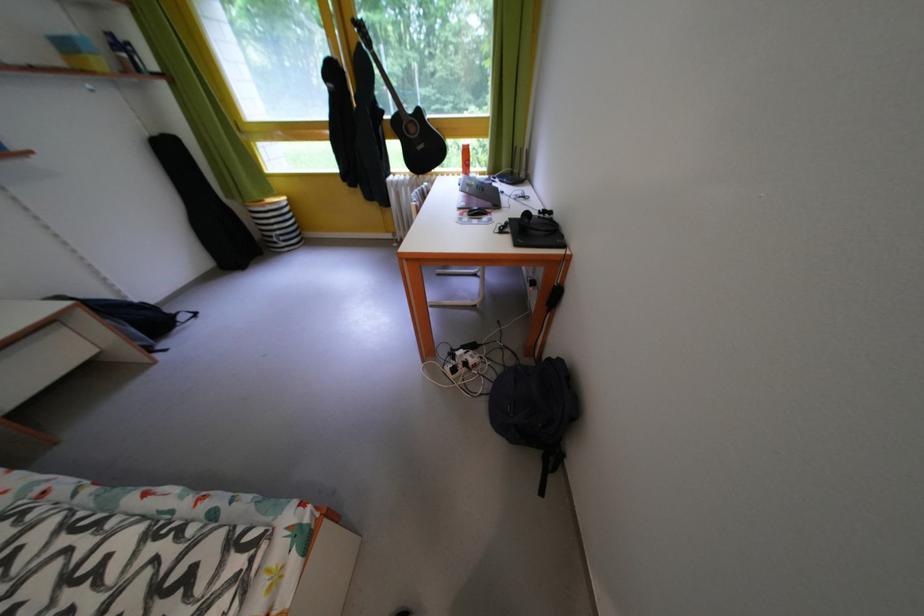
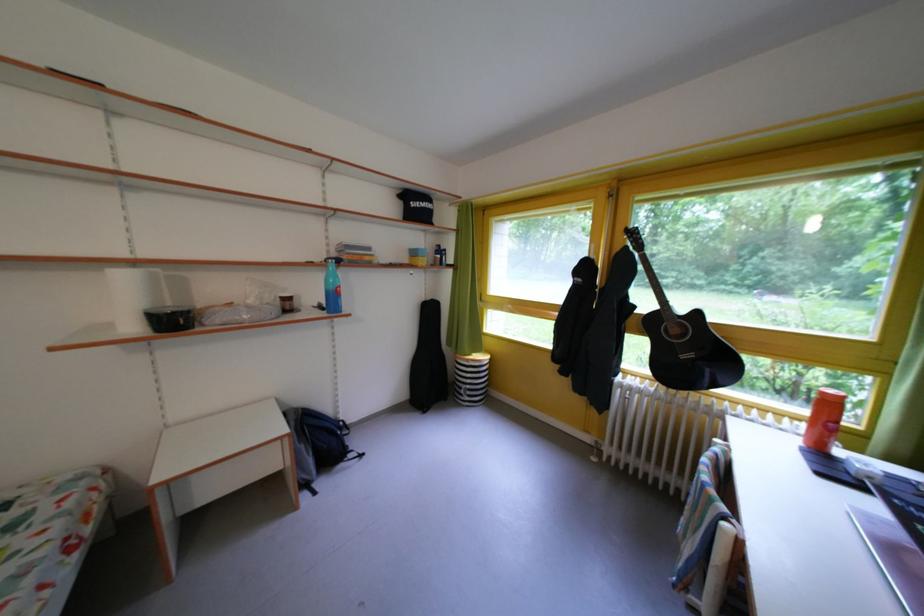
In the second image, find the point that corresponds to pixel 287 238 in the first image.

(478, 392)